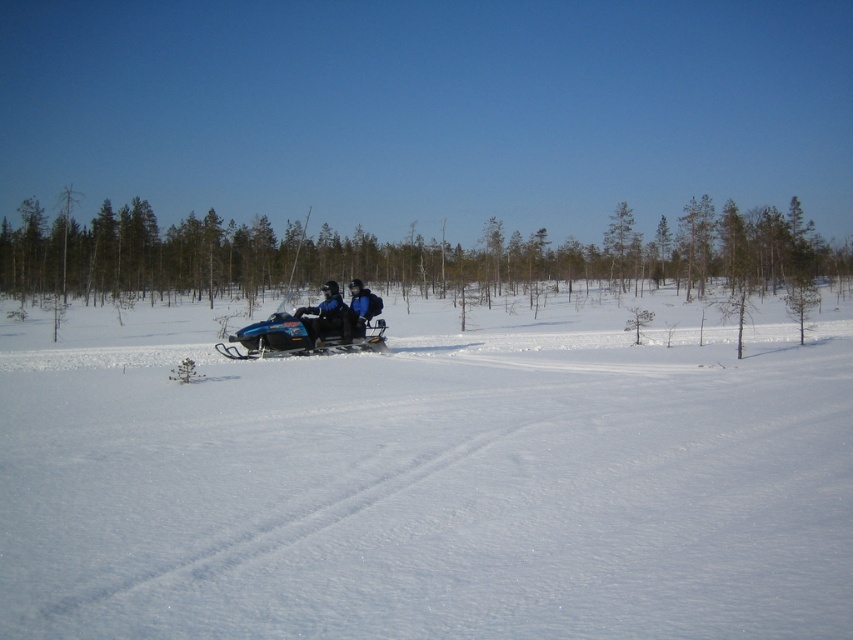
Question: Can you confirm if brown wood tree at center is positioned below blue fabric jacket at center?

Choices:
 (A) yes
 (B) no

Answer: (B)

Question: Estimate the real-world distances between objects in this image. Which object is closer to the blue matte jacket at center?

Choices:
 (A) blue plastic snowmobile at center
 (B) brown wood tree at center
 (C) white powdery snow at center

Answer: (A)

Question: Does blue fabric jacket at center appear on the left side of blue matte jacket at center?

Choices:
 (A) yes
 (B) no

Answer: (A)

Question: Which point is farther from the camera taking this photo?

Choices:
 (A) (328, 307)
 (B) (303, 348)

Answer: (A)

Question: Observing the image, what is the correct spatial positioning of brown wood tree at center in reference to blue fabric jacket at center?

Choices:
 (A) right
 (B) left

Answer: (B)

Question: Which point is farther to the camera?

Choices:
 (A) (335, 314)
 (B) (604, 417)

Answer: (A)